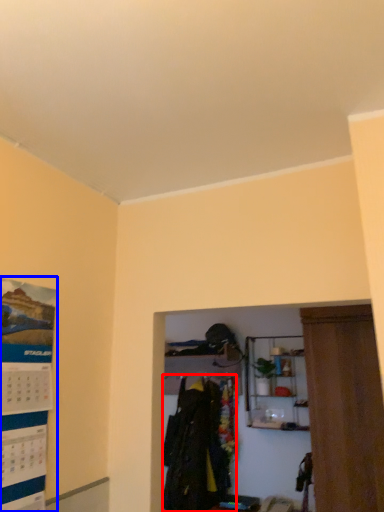
Question: Which of the following is the farthest to the observer, clothing (highlighted by a red box) or poster page (highlighted by a blue box)?

Choices:
 (A) clothing
 (B) poster page

Answer: (A)